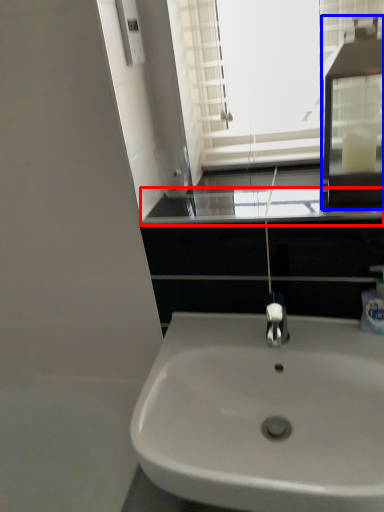
Question: Among these objects, which one is nearest to the camera, window sill (highlighted by a red box) or medicine cabinet (highlighted by a blue box)?

Choices:
 (A) window sill
 (B) medicine cabinet

Answer: (B)